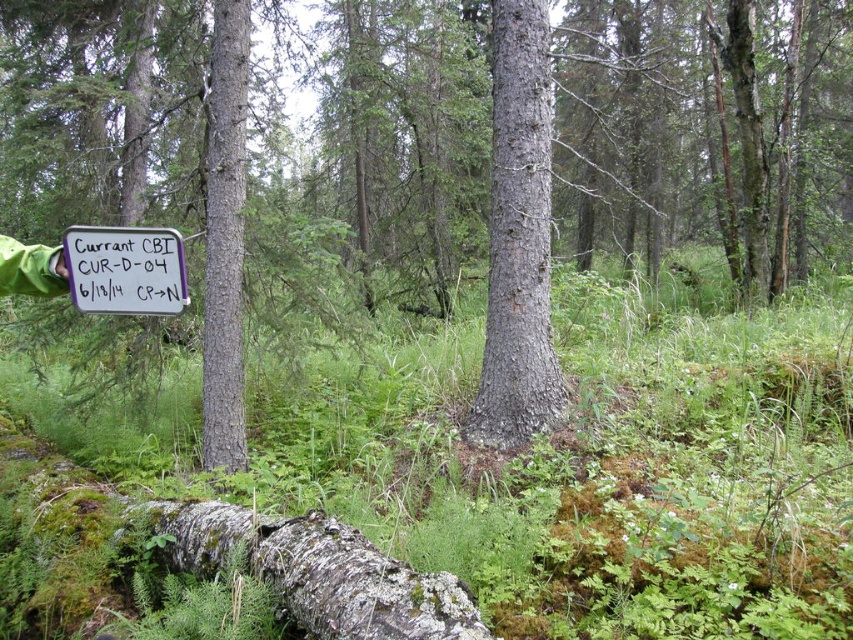
Question: Which point appears closest to the camera in this image?

Choices:
 (A) (552, 372)
 (B) (387, 209)
 (C) (225, 19)
 (D) (144, 253)

Answer: (D)

Question: Is smooth bark tree at center positioned behind smooth gray bark at center?

Choices:
 (A) yes
 (B) no

Answer: (A)

Question: Based on their relative distances, which object is farther from the smooth bark tree at center?

Choices:
 (A) white paper sign at center
 (B) smooth gray tree trunk at center

Answer: (A)

Question: Is smooth gray bark at center closer to camera compared to white paper sign at center?

Choices:
 (A) yes
 (B) no

Answer: (B)

Question: Estimate the real-world distances between objects in this image. Which object is farther from the smooth gray tree trunk at center?

Choices:
 (A) white paper sign at center
 (B) smooth gray bark at center

Answer: (A)

Question: Where is smooth gray bark at center located in relation to white paper sign at center in the image?

Choices:
 (A) below
 (B) above

Answer: (B)